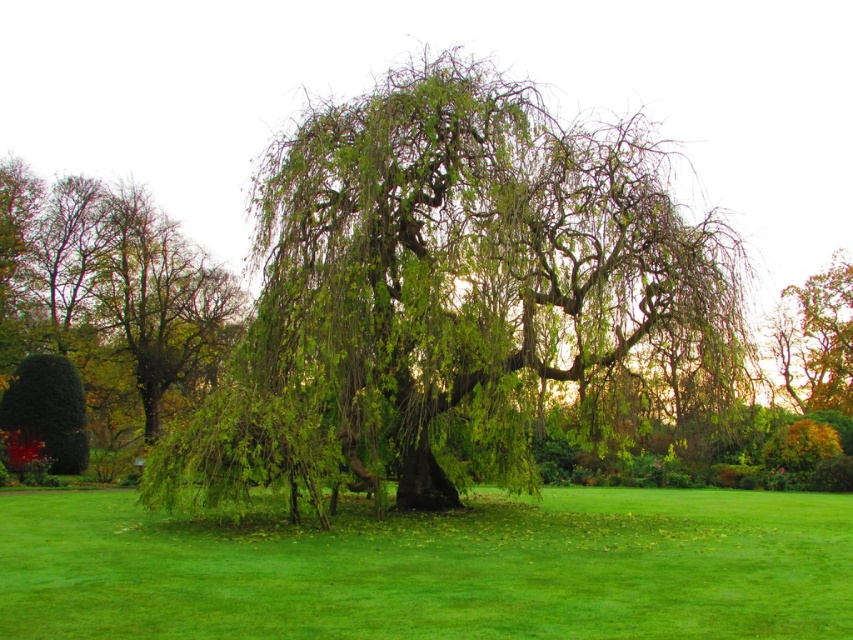
You are planning to place a picnic blanket in the garden. The picnic blanket is 2 meters wide. Considering the space occupied by the green leafy willow at center and the green grass at center, can you fit the blanket between them without overlapping either?

The green leafy willow at center is narrower than the green grass at center. However, the question mentions placing the blanket between them, but since both are at the center, they likely occupy the same central area. Therefore, the blanket might not fit without overlapping one or both.